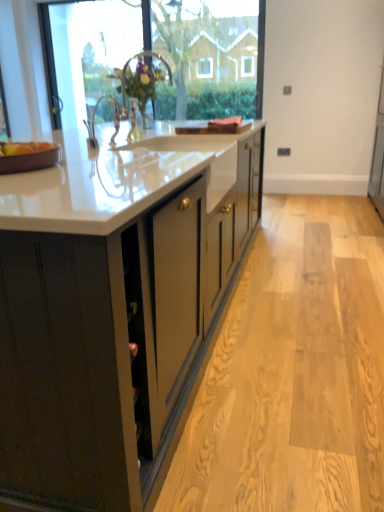
Question: From a real-world perspective, is matte black cabinets at center above or below white glossy sink at upper center?

Choices:
 (A) below
 (B) above

Answer: (A)

Question: Is point pos(135,496) positioned closer to the camera than point pos(132,96)?

Choices:
 (A) farther
 (B) closer

Answer: (B)

Question: Estimate the real-world distances between objects in this image. Which object is closer to the white glossy sink at upper center?

Choices:
 (A) transparent glass window at upper center
 (B) matte black cabinets at center
 (C) matte brown apple at left
 (D) transparent glass door at upper left
 (E) brown matte tray at left

Answer: (D)

Question: Which object is positioned farthest from the transparent glass window at upper center?

Choices:
 (A) matte brown apple at left
 (B) transparent glass door at upper left
 (C) white glossy sink at upper center
 (D) brown matte tray at left
 (E) matte black cabinets at center

Answer: (D)